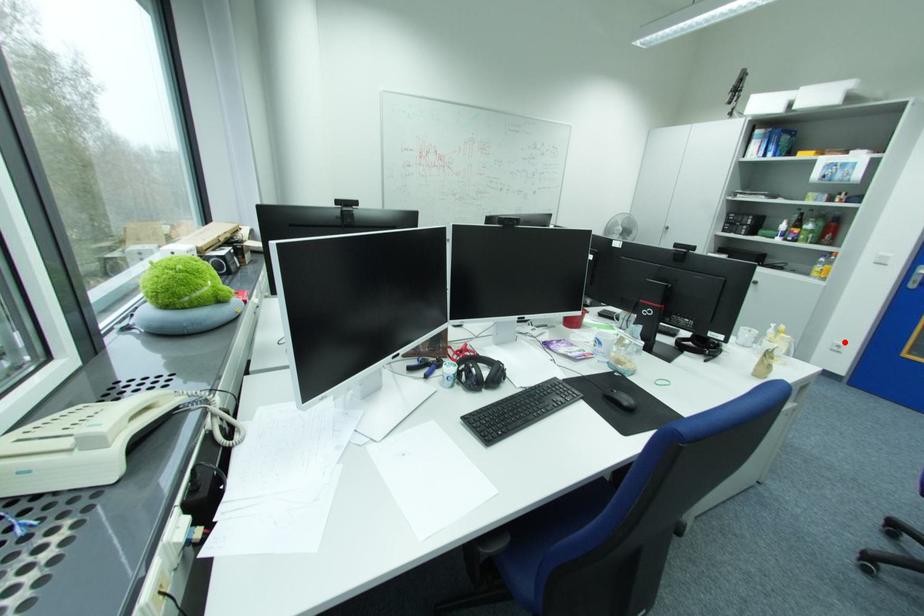
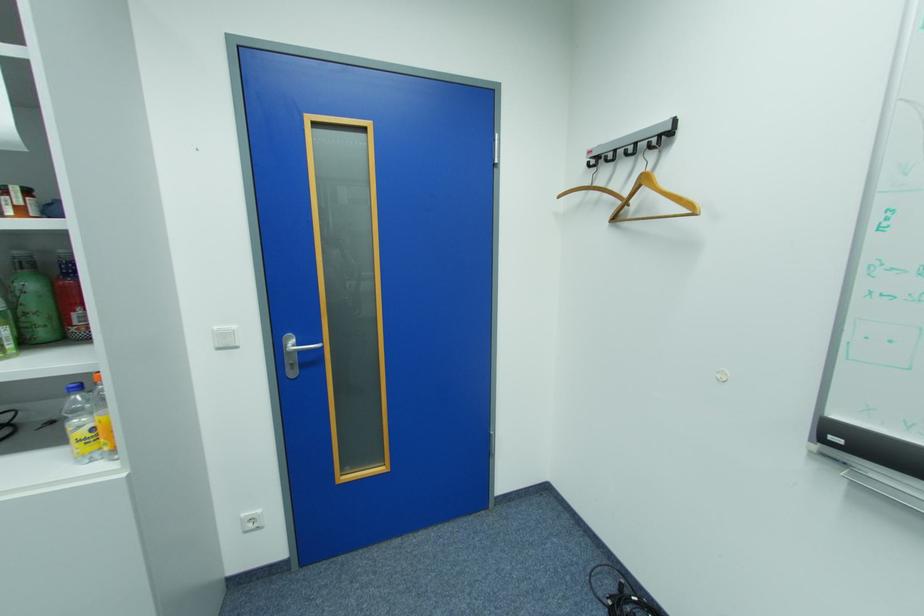
Question: A red point is marked in image1. In image2, is the corresponding 3D point closer to the camera or farther? Reply with the corresponding letter.

Choices:
 (A) The corresponding 3D point is closer.
 (B) The corresponding 3D point is farther.

Answer: (A)